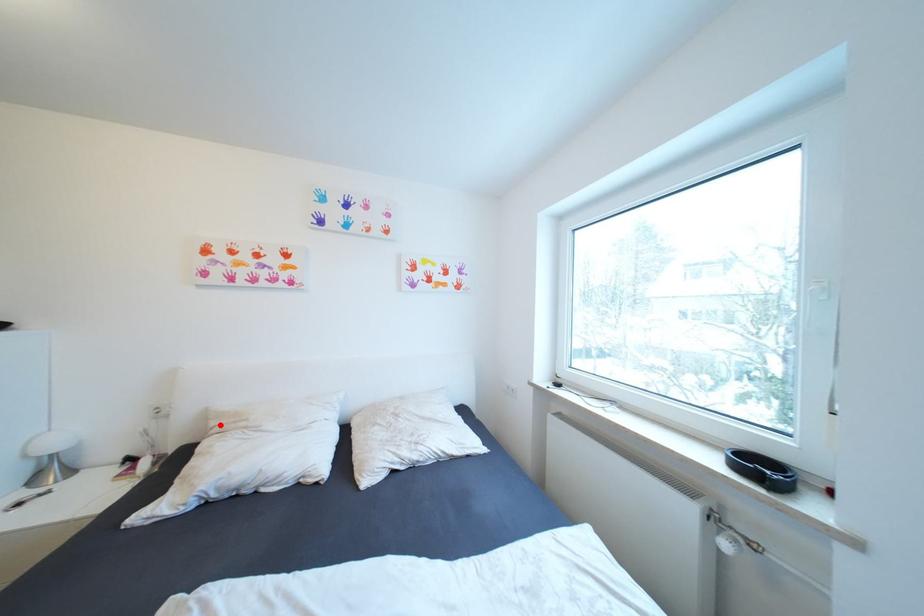
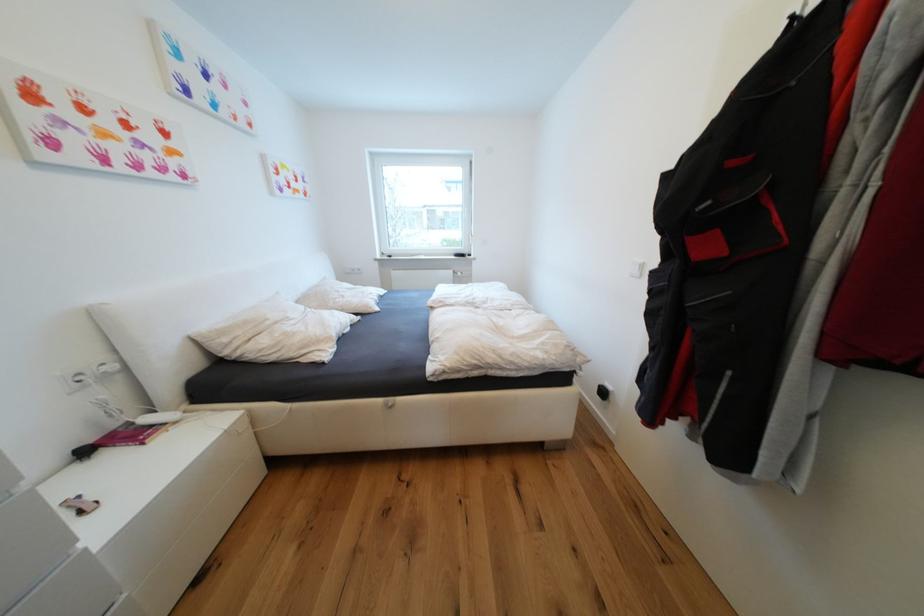
Find the pixel in the second image that matches the highlighted location in the first image.

(233, 341)